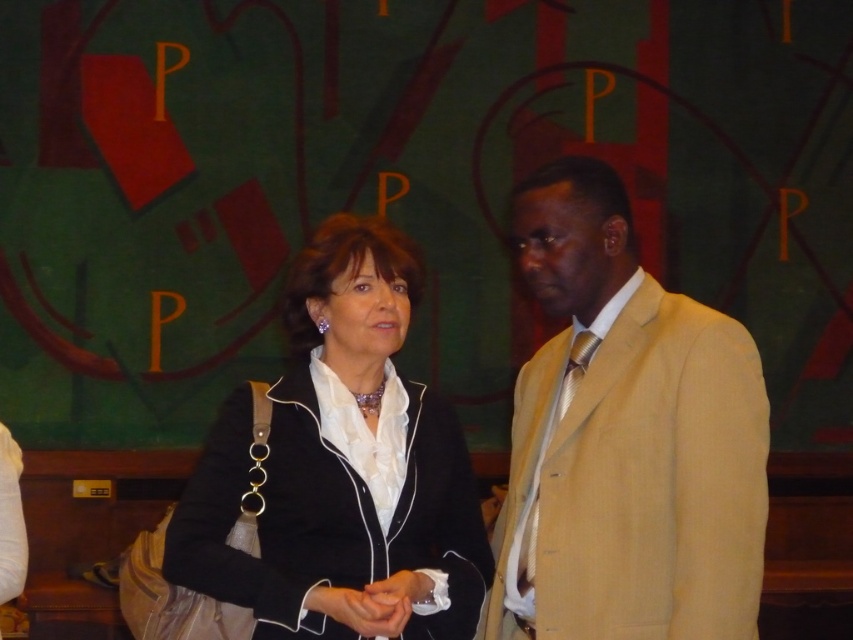
You are a GUI agent. You are given a task and a screenshot of the screen. Output one action in this format:
    pyautogui.click(x=<x>, y=<y>)
    Task: Click on the tan textured suit at center
    The height and width of the screenshot is (640, 853).
    Given the screenshot: What is the action you would take?
    pyautogui.click(x=625, y=438)

Does tan textured suit at center appear under black satin blazer at center?

No, tan textured suit at center is not below black satin blazer at center.

Find the location of a particular element. The image size is (853, 640). tan textured suit at center is located at coordinates (625, 438).

This screenshot has height=640, width=853. Find the location of `tan textured suit at center`. tan textured suit at center is located at coordinates (625, 438).